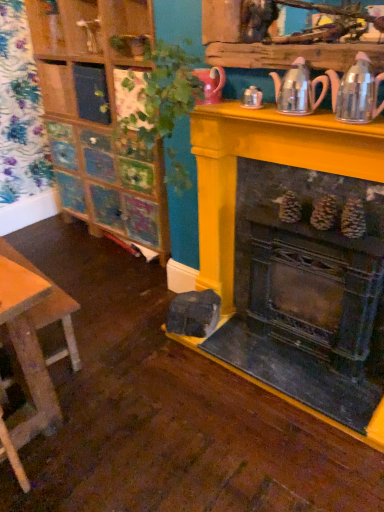
Question: From the image's perspective, is metallic silver tea pot at upper right, arranged as the first tea pot when viewed from the right, over green leafy plant at upper center?

Choices:
 (A) no
 (B) yes

Answer: (B)

Question: Is green leafy plant at upper center completely or partially inside metallic silver tea pot at upper right, which is the 2th tea pot in left-to-right order?

Choices:
 (A) no
 (B) yes

Answer: (A)

Question: From a real-world perspective, is metallic silver tea pot at upper right, which is the 2th tea pot in left-to-right order, over green leafy plant at upper center?

Choices:
 (A) yes
 (B) no

Answer: (A)

Question: Does metallic silver tea pot at upper right, which is the 2th tea pot in left-to-right order, have a greater height compared to green leafy plant at upper center?

Choices:
 (A) yes
 (B) no

Answer: (B)

Question: Considering the relative positions of metallic silver tea pot at upper right, arranged as the first tea pot when viewed from the right, and green leafy plant at upper center in the image provided, is metallic silver tea pot at upper right, arranged as the first tea pot when viewed from the right, behind green leafy plant at upper center?

Choices:
 (A) no
 (B) yes

Answer: (A)

Question: Considering the positions of point (347, 334) and point (342, 113), is point (347, 334) closer or farther from the camera than point (342, 113)?

Choices:
 (A) closer
 (B) farther

Answer: (B)

Question: Do you think rustic metal fireplace at center is within metallic silver tea pot at upper right, arranged as the first tea pot when viewed from the right, or outside of it?

Choices:
 (A) outside
 (B) inside

Answer: (A)

Question: Is rustic metal fireplace at center taller or shorter than metallic silver tea pot at upper right, which is the 2th tea pot in left-to-right order?

Choices:
 (A) short
 (B) tall

Answer: (B)

Question: From the image's perspective, is rustic metal fireplace at center positioned above or below metallic silver tea pot at upper right, which is the 2th tea pot in left-to-right order?

Choices:
 (A) below
 (B) above

Answer: (A)

Question: Is wooden stool at lower left inside or outside of green leafy plant at upper center?

Choices:
 (A) inside
 (B) outside

Answer: (B)

Question: Looking at their shapes, would you say wooden stool at lower left is wider or thinner than green leafy plant at upper center?

Choices:
 (A) thin
 (B) wide

Answer: (A)

Question: From a real-world perspective, is wooden stool at lower left positioned above or below green leafy plant at upper center?

Choices:
 (A) above
 (B) below

Answer: (B)

Question: Is wooden stool at lower left to the left or to the right of green leafy plant at upper center in the image?

Choices:
 (A) left
 (B) right

Answer: (A)

Question: From the image's perspective, is metallic silver tea pot at upper right, which is the 2th tea pot in left-to-right order, above or below green leafy plant at upper center?

Choices:
 (A) above
 (B) below

Answer: (A)

Question: Is metallic silver tea pot at upper right, arranged as the first tea pot when viewed from the right, wider or thinner than green leafy plant at upper center?

Choices:
 (A) thin
 (B) wide

Answer: (A)